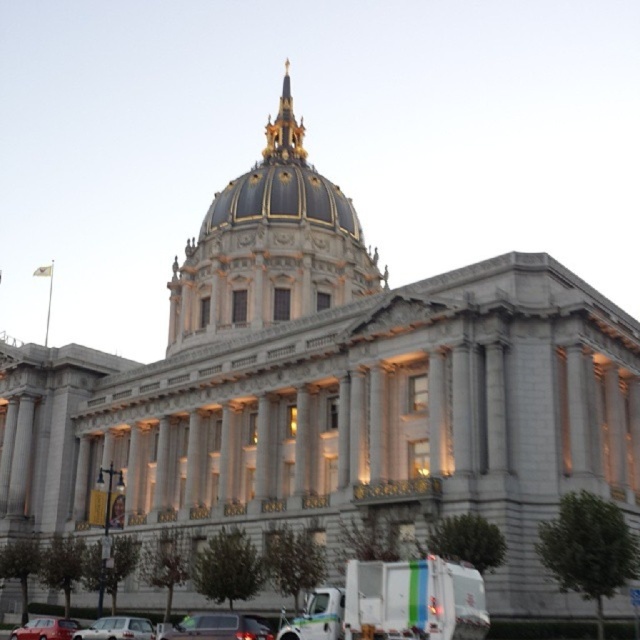
Who is lower down, white glossy truck at lower center or silver metallic sedan at lower center?

Answer: Positioned lower is silver metallic sedan at lower center.

Between white glossy truck at lower center and silver metallic sedan at lower center, which one has less height?

With less height is silver metallic sedan at lower center.

Is point (371, 579) positioned before point (113, 627)?

Yes.

You are a GUI agent. You are given a task and a screenshot of the screen. Output one action in this format:
    pyautogui.click(x=<x>, y=<y>)
    Task: Click on the white glossy truck at lower center
    
    Given the screenshot: What is the action you would take?
    pyautogui.click(x=396, y=604)

Based on the photo, which is more to the left, white glossy truck at lower center or shiny silver sedan at lower center?

shiny silver sedan at lower center

The width and height of the screenshot is (640, 640). Identify the location of white glossy truck at lower center. (396, 604).

You are a GUI agent. You are given a task and a screenshot of the screen. Output one action in this format:
    pyautogui.click(x=<x>, y=<y>)
    Task: Click on the white glossy truck at lower center
    The height and width of the screenshot is (640, 640).
    Given the screenshot: What is the action you would take?
    pyautogui.click(x=396, y=604)

Who is taller, goldmaterial/texturedome at center or shiny red car at lower left?

With more height is goldmaterial/texturedome at center.

Does goldmaterial/texturedome at center appear on the right side of shiny red car at lower left?

Correct, you'll find goldmaterial/texturedome at center to the right of shiny red car at lower left.

Locate an element on the screen. goldmaterial/texturedome at center is located at coordinates (269, 244).